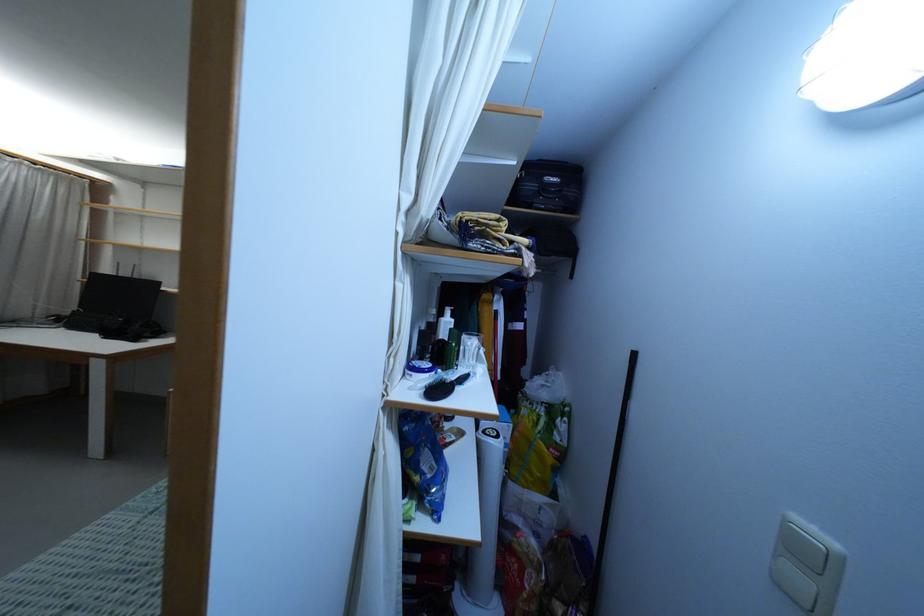
The location [468,351] corresponds to which object?

It corresponds to the clear drinking glass in the image.